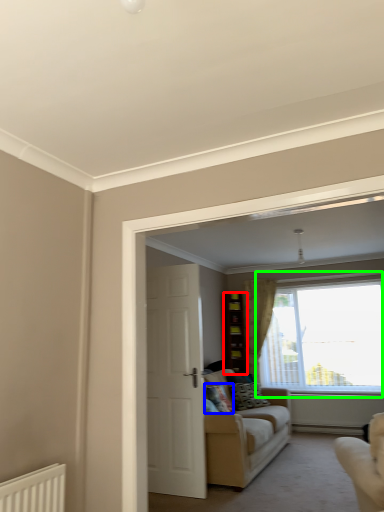
Question: Considering the real-world distances, which object is farthest from cabinetry (highlighted by a red box)? pillow (highlighted by a blue box) or window (highlighted by a green box)?

Choices:
 (A) pillow
 (B) window

Answer: (A)